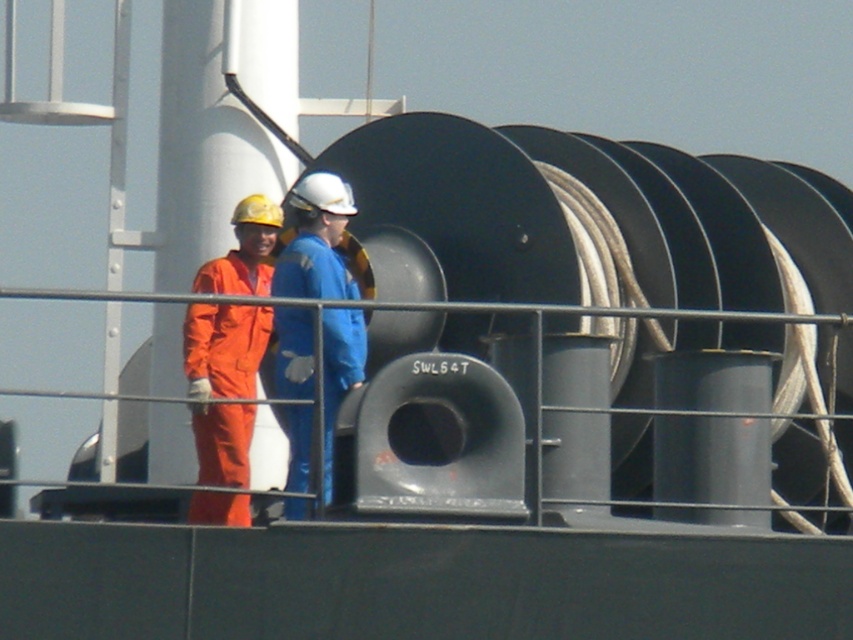
Question: Can you confirm if orange coveralls at left is positioned above blue matte coveralls at center?

Choices:
 (A) no
 (B) yes

Answer: (A)

Question: Which object is closer to the camera taking this photo?

Choices:
 (A) orange coveralls at left
 (B) blue matte coveralls at center

Answer: (B)

Question: Which object is closer to the camera taking this photo?

Choices:
 (A) orange coveralls at left
 (B) blue matte coveralls at center

Answer: (B)

Question: Does orange coveralls at left appear on the left side of blue matte coveralls at center?

Choices:
 (A) yes
 (B) no

Answer: (A)

Question: Does orange coveralls at left have a larger size compared to blue matte coveralls at center?

Choices:
 (A) yes
 (B) no

Answer: (A)